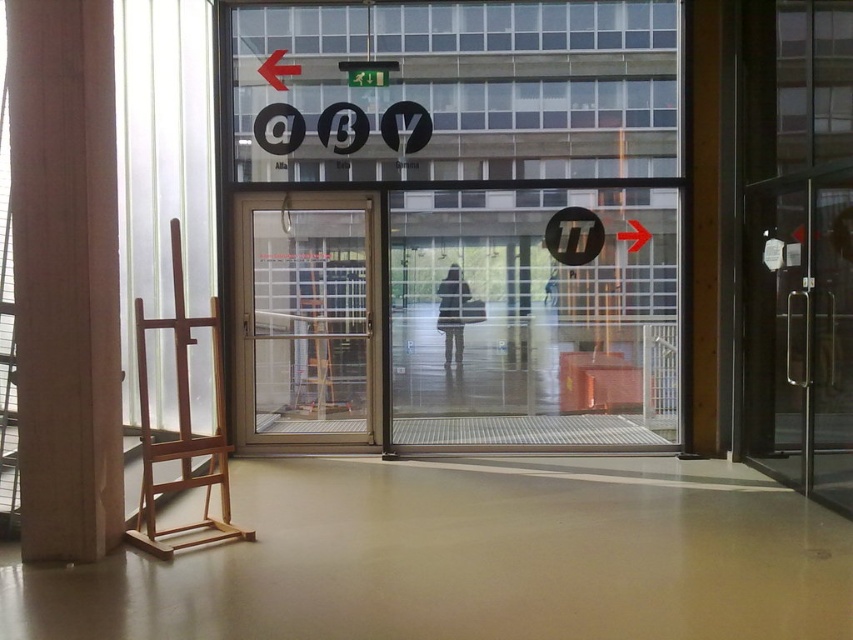
Does gold metallic door at center have a greater width compared to transparent glass arrow at right?

Yes.

Can you confirm if gold metallic door at center is taller than transparent glass arrow at right?

Yes, gold metallic door at center is taller than transparent glass arrow at right.

Is point (306, 362) less distant than point (637, 244)?

No, it is not.

Identify the location of gold metallic door at center. Image resolution: width=853 pixels, height=640 pixels. (305, 317).

Does gold metallic door at center have a larger size compared to red plastic arrow at upper left?

Indeed, gold metallic door at center has a larger size compared to red plastic arrow at upper left.

Does gold metallic door at center appear under red plastic arrow at upper left?

Yes, gold metallic door at center is below red plastic arrow at upper left.

Where is `gold metallic door at center`? gold metallic door at center is located at coordinates (305, 317).

Is point (276, 58) positioned behind point (637, 224)?

No, (276, 58) is closer to viewer.

Looking at this image, which is more to the right, red plastic arrow at upper left or transparent glass arrow at right?

transparent glass arrow at right

Does point (299, 72) lie in front of point (631, 248)?

Yes, point (299, 72) is closer to viewer.

Find the location of a particular element. red plastic arrow at upper left is located at coordinates (277, 68).